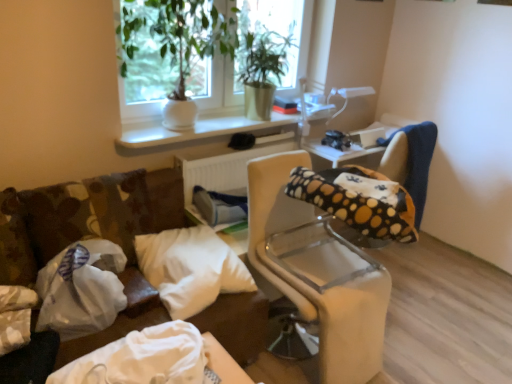
The width and height of the screenshot is (512, 384). Find the location of `polka dot fabric bean bag chair at right`. polka dot fabric bean bag chair at right is located at coordinates (374, 190).

Find the location of a particular element. The height and width of the screenshot is (384, 512). white plastic bag at left is located at coordinates (81, 289).

The height and width of the screenshot is (384, 512). I want to click on green leafy plant at upper center, so click(x=233, y=86).

Is white plastic radiator at center oriented towards white glossy window sill at upper center?

No, white plastic radiator at center is not turned towards white glossy window sill at upper center.

Is white plastic radiator at center in front of white glossy window sill at upper center?

No.

Which is less distant, (217,170) or (187,141)?

The point (187,141) is closer.

Is white plastic radiator at center in contact with white glossy window sill at upper center?

No, white plastic radiator at center is not with white glossy window sill at upper center.

Identify the location of window screen on the right of white fabric bag at lower left. (269, 40).

Considering the sizes of white fabric bag at lower left and green matte plant at upper center in the image, is white fabric bag at lower left bigger or smaller than green matte plant at upper center?

In the image, white fabric bag at lower left appears to be smaller than green matte plant at upper center.

How different are the orientations of white fabric bag at lower left and green matte plant at upper center in degrees?

The angular difference between white fabric bag at lower left and green matte plant at upper center is 0.55 degrees.

From the picture: Between white fabric bag at lower left and green matte plant at upper center, which one has smaller width?

green matte plant at upper center.

Who is taller, white glossy window sill at upper center or white fabric bag at lower left?

white fabric bag at lower left.

Does white glossy window sill at upper center have a larger size compared to white fabric bag at lower left?

No.

Is white glossy window sill at upper center oriented towards white fabric bag at lower left?

No, white glossy window sill at upper center does not turn towards white fabric bag at lower left.

From the image's perspective, which one is positioned higher, white glossy window sill at upper center or white fabric bag at lower left?

From the image's view, white glossy window sill at upper center is above.

Find the location of `window lying above the polka dot fabric bean bag chair at right (from the image's perspective)`. window lying above the polka dot fabric bean bag chair at right (from the image's perspective) is located at coordinates (233, 86).

Between green leafy plant at upper center and polka dot fabric bean bag chair at right, which one has less height?

With less height is green leafy plant at upper center.

Between green leafy plant at upper center and polka dot fabric bean bag chair at right, which one has smaller width?

Thinner between the two is green leafy plant at upper center.

Is the surface of green leafy plant at upper center in direct contact with polka dot fabric bean bag chair at right?

No, green leafy plant at upper center is not touching polka dot fabric bean bag chair at right.

How distant is polka dot fabric bean bag chair at right from green leafy plant at upper center?

polka dot fabric bean bag chair at right and green leafy plant at upper center are 1.00 meters apart.

Is polka dot fabric bean bag chair at right smaller than green leafy plant at upper center?

Correct, polka dot fabric bean bag chair at right occupies less space than green leafy plant at upper center.

In the scene shown: Is polka dot fabric bean bag chair at right aimed at green leafy plant at upper center?

No, polka dot fabric bean bag chair at right is not aimed at green leafy plant at upper center.

Which is more to the right, polka dot fabric bean bag chair at right or green leafy plant at upper center?

polka dot fabric bean bag chair at right.

From the image's perspective, which one is positioned lower, green matte plant at upper center or green leafy plant at upper center?

green leafy plant at upper center appears lower in the image.

In the scene shown: Does green matte plant at upper center have a greater width compared to green leafy plant at upper center?

No.

Do you think green matte plant at upper center is within green leafy plant at upper center, or outside of it?

green matte plant at upper center is not enclosed by green leafy plant at upper center.

Between point (289, 42) and point (254, 19), which one is positioned behind?

The point (254, 19) is farther from the camera.

Considering the sizes of white soft pillow at center and white glossy window sill at upper center in the image, is white soft pillow at center bigger or smaller than white glossy window sill at upper center?

white soft pillow at center is bigger than white glossy window sill at upper center.

Looking at this image, considering the positions of objects white soft pillow at center and white glossy window sill at upper center in the image provided, who is more to the left, white soft pillow at center or white glossy window sill at upper center?

white soft pillow at center is more to the left.

From the picture: Considering the relative sizes of white soft pillow at center and white glossy window sill at upper center in the image provided, is white soft pillow at center taller than white glossy window sill at upper center?

Correct, white soft pillow at center is much taller as white glossy window sill at upper center.

At what (x,y) coordinates should I click in order to perform the action: click on window sill lying behind the white soft pillow at center. Please return your answer as a coordinate pair (x, y). This screenshot has height=384, width=512. Looking at the image, I should click on (195, 131).

You are a GUI agent. You are given a task and a screenshot of the screen. Output one action in this format:
    pyautogui.click(x=<x>, y=<y>)
    Task: Click on the radiator lying behind the white glossy window sill at upper center
    This screenshot has height=384, width=512.
    Given the screenshot: What is the action you would take?
    pyautogui.click(x=224, y=166)

Find the location of a particular element. table to the left of green matte plant at upper center is located at coordinates (154, 359).

When comparing their distances from white glossy window sill at upper center, does white plastic bag at left or green matte plant at upper center seem further?

white plastic bag at left is further to white glossy window sill at upper center.

Based on their spatial positions, is white plastic radiator at center or white plastic bag at left further from green matte plant at upper center?

white plastic bag at left is further to green matte plant at upper center.

From the image, which object appears to be nearer to white fabric bag at lower left, polka dot fabric bean bag chair at right or green leafy plant at upper center?

Based on the image, polka dot fabric bean bag chair at right appears to be nearer to white fabric bag at lower left.

Consider the image. Considering their positions, is white glossy window sill at upper center positioned further to green matte plant at upper center than white fabric bag at lower left?

Among the two, white fabric bag at lower left is located further to green matte plant at upper center.

In the scene shown: Which object lies further to the anchor point white plastic bag at left, green matte plant at upper center or white glossy window sill at upper center?

Among the two, green matte plant at upper center is located further to white plastic bag at left.

From the image, which object appears to be farther from white glossy window sill at upper center, green leafy plant at upper center or green matte plant at upper center?

green matte plant at upper center is positioned further to the anchor white glossy window sill at upper center.

Consider the image. Which object lies further to the anchor point beige fabric chair at center, white soft pillow at center or polka dot fabric bean bag chair at right?

Among the two, white soft pillow at center is located further to beige fabric chair at center.

Which object lies further to the anchor point green matte plant at upper center, white soft pillow at center or beige fabric chair at center?

Based on the image, white soft pillow at center appears to be further to green matte plant at upper center.

The height and width of the screenshot is (384, 512). Find the location of `pillow that lies between white glossy window sill at upper center and white plastic bag at left from top to bottom`. pillow that lies between white glossy window sill at upper center and white plastic bag at left from top to bottom is located at coordinates (191, 268).

Find the location of a particular element. The height and width of the screenshot is (384, 512). window sill between green leafy plant at upper center and beige fabric chair at center in the vertical direction is located at coordinates (195, 131).

Identify the location of material between green leafy plant at upper center and white fabric bag at lower left in the vertical direction. (81, 289).

Identify the location of window screen positioned between beige fabric chair at center and polka dot fabric bean bag chair at right from near to far. (269, 40).